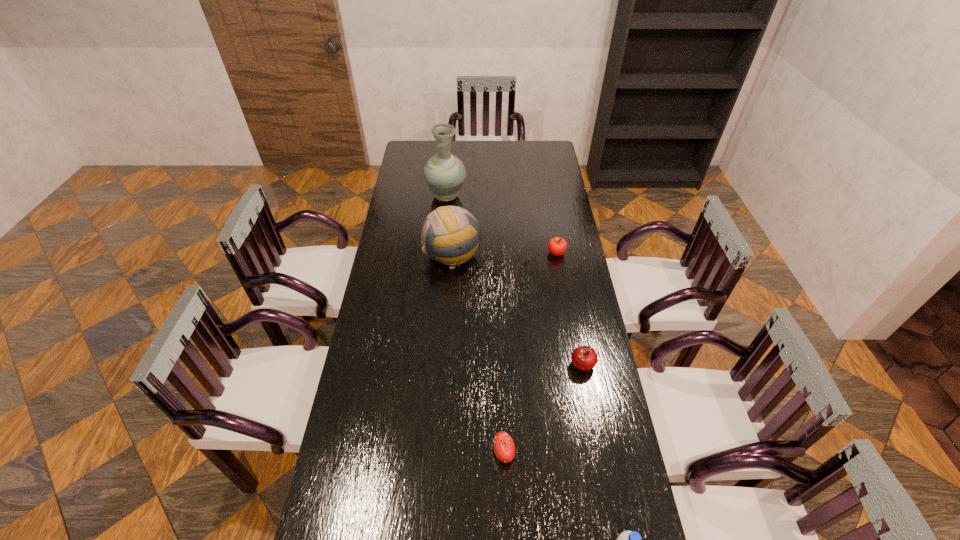
Where is `the farthest object`? the farthest object is located at coordinates (444, 173).

Where is `pitcher`? The width and height of the screenshot is (960, 540). pitcher is located at coordinates (444, 173).

This screenshot has height=540, width=960. Identify the location of volleyball. (455, 228).

This screenshot has height=540, width=960. Find the location of `the farthest apple`. the farthest apple is located at coordinates (557, 246).

In order to click on the fourth farthest object in this screenshot , I will do `click(584, 358)`.

Locate an element on the screen. The image size is (960, 540). the nearest apple is located at coordinates (504, 447).

Where is `the leftmost apple`? the leftmost apple is located at coordinates (504, 447).

At what (x,y) coordinates should I click in order to perform the action: click on vacant space located on the handle side of the tallest object. Please return your answer as a coordinate pair (x, y). The width and height of the screenshot is (960, 540). Looking at the image, I should click on (450, 152).

You are a GUI agent. You are given a task and a screenshot of the screen. Output one action in this format:
    pyautogui.click(x=<x>, y=<y>)
    Task: Click on the vacant region located 0.280m on the handle side of the tallest object
    
    Given the screenshot: What is the action you would take?
    pyautogui.click(x=450, y=156)

This screenshot has width=960, height=540. In order to click on vacant space located 0.130m on the handle side of the tallest object in this screenshot , I will do pyautogui.click(x=448, y=171).